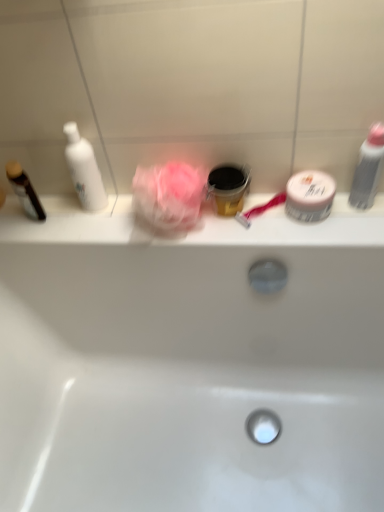
Find the location of a particular element. vacant area that lies between pink fabric rose at center and white glossy bottle at left is located at coordinates (111, 218).